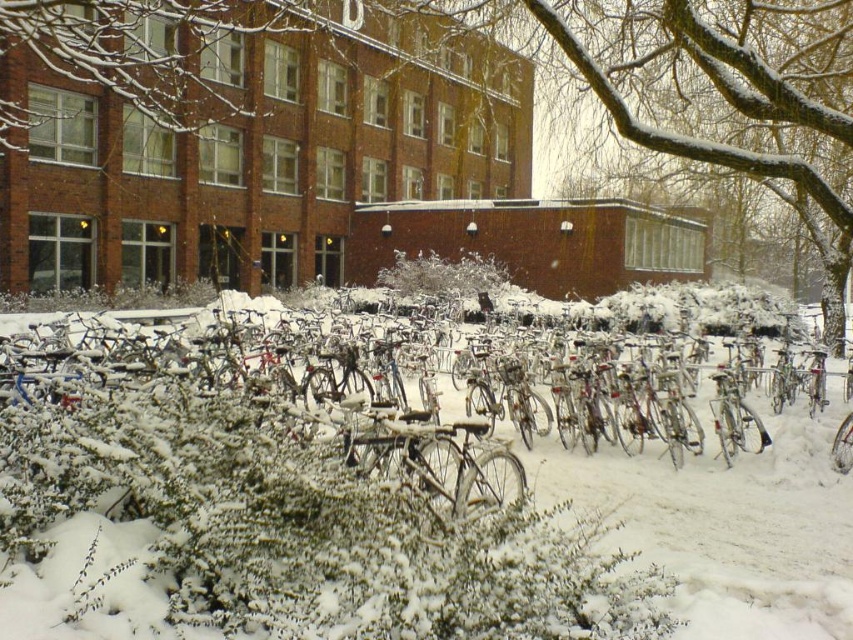
You are a delivery person trying to navigate through the snowy area between the metallic silver bicycle at center and the white fluffy bush at center. Based on their heights, which one might block your view more when looking ahead?

The metallic silver bicycle at center is taller than the white fluffy bush at center, so it would block your view more when looking ahead.

You are standing at the entrance of the building and want to find the metallic silver bicycle at center. According to the coordinates provided, in which direction should you look to locate it?

The metallic silver bicycle at center is located at coordinates point (712, 472), so you should look towards the lower right direction from your current position at the entrance.

You are a delivery person who needs to move the metallic silver bicycle at center to make space for a new delivery van. Can you move it without disturbing the white fluffy bush at center?

Yes, the metallic silver bicycle at center is in front of the white fluffy bush at center, so moving it forward or sideways would not disturb the bush behind it.